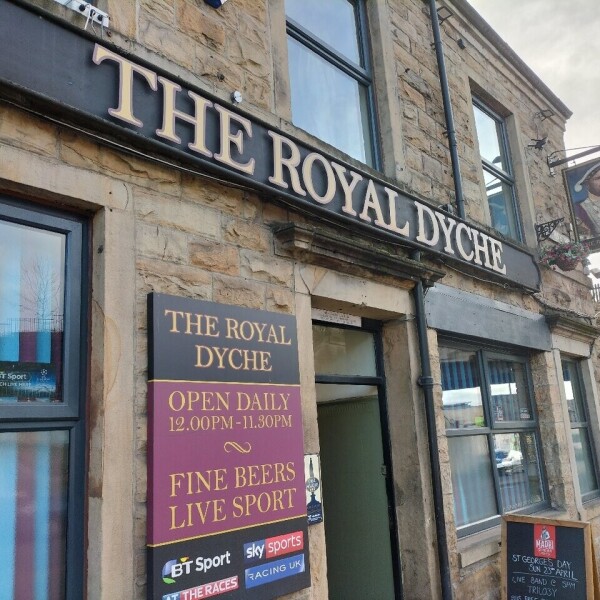
In order to click on door in this screenshot , I will do `click(361, 490)`.